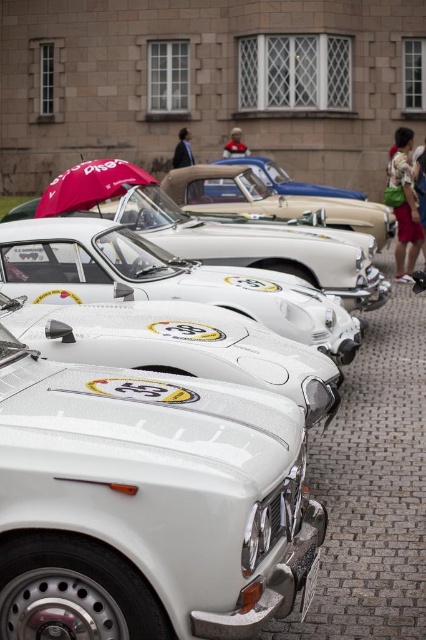
Between dark fabric jacket at upper center and blue fabric umbrella at upper left, which one is positioned lower?

Positioned lower is dark fabric jacket at upper center.

Can you confirm if dark fabric jacket at upper center is wider than blue fabric umbrella at upper left?

No, dark fabric jacket at upper center is not wider than blue fabric umbrella at upper left.

Which is behind, point (189, 136) or point (244, 150)?

Positioned behind is point (189, 136).

The width and height of the screenshot is (426, 640). In order to click on dark fabric jacket at upper center in this screenshot , I will do `click(183, 150)`.

Does metallic blue car at center appear over dark blue jeans at lower right?

Yes, metallic blue car at center is above dark blue jeans at lower right.

Is metallic blue car at center behind dark blue jeans at lower right?

Yes, metallic blue car at center is further from the viewer.

Is point (313, 192) positioned in front of point (420, 195)?

No, it is behind (420, 195).

The height and width of the screenshot is (640, 426). Identify the location of metallic blue car at center. (287, 179).

This screenshot has height=640, width=426. What do you see at coordinates (270, 198) in the screenshot?
I see `white glossy car at center` at bounding box center [270, 198].

Between point (178, 170) and point (423, 177), which one is positioned behind?

The point (178, 170) is more distant.

Does point (233, 172) come closer to viewer compared to point (422, 170)?

No, it is behind (422, 170).

Locate an element on the screen. The image size is (426, 640). white glossy car at center is located at coordinates (270, 198).